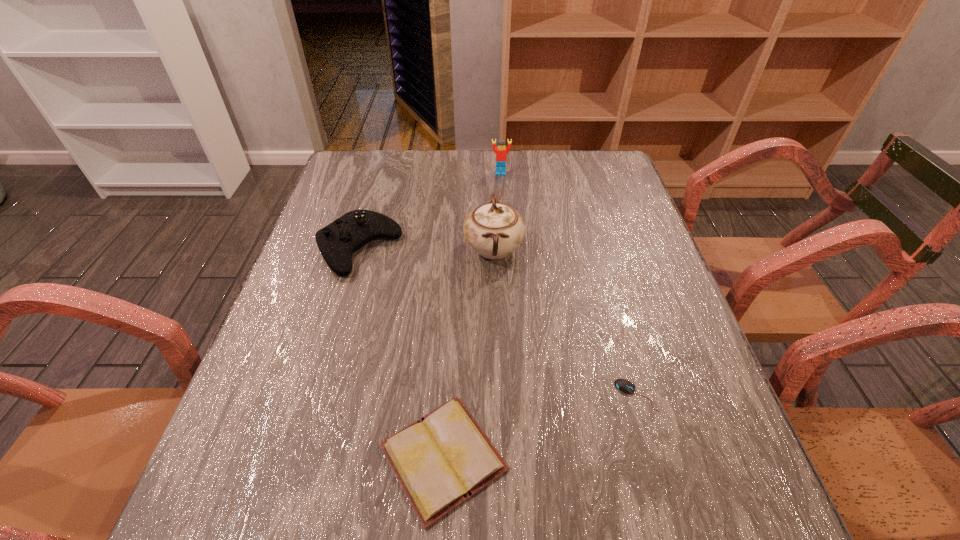
Find the location of a particular element. The image size is (960, 540). free spot at the right edge of the desktop is located at coordinates click(679, 420).

Where is `free space at the far left corner of the desktop`? free space at the far left corner of the desktop is located at coordinates (366, 190).

What are the coordinates of `vacant space at the near right corner of the desktop` in the screenshot? It's located at (768, 538).

Where is `free spot between the tallest object and the control`? This screenshot has height=540, width=960. free spot between the tallest object and the control is located at coordinates (426, 249).

The image size is (960, 540). I want to click on empty space between the second shortest object and the farthest object, so pos(472,315).

The image size is (960, 540). Identify the location of free spot between the chinaware and the shortest object. (564, 322).

Locate an element on the screen. The image size is (960, 540). free point between the leftmost object and the farthest object is located at coordinates (430, 211).

I want to click on empty location between the rightmost object and the leftmost object, so [x=497, y=322].

The height and width of the screenshot is (540, 960). I want to click on free point between the shortest object and the third tallest object, so click(x=497, y=322).

Locate an element on the screen. vacant area that lies between the farthest object and the mouse is located at coordinates (568, 284).